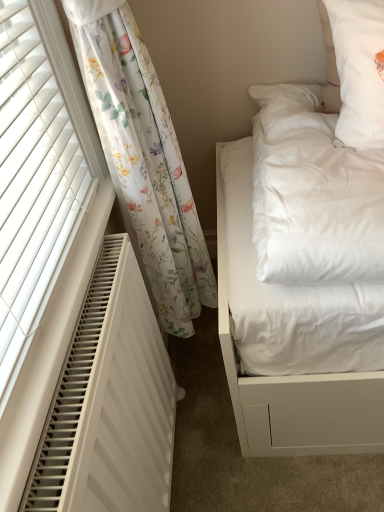
Question: From a real-world perspective, is floral sheer curtain at left positioned above or below white textured radiator at left?

Choices:
 (A) below
 (B) above

Answer: (B)

Question: Considering the positions of floral sheer curtain at left and white textured radiator at left in the image, is floral sheer curtain at left taller or shorter than white textured radiator at left?

Choices:
 (A) short
 (B) tall

Answer: (B)

Question: Relative to white textured radiator at left, is floral sheer curtain at left in front or behind?

Choices:
 (A) front
 (B) behind

Answer: (B)

Question: In terms of size, does white textured radiator at left appear bigger or smaller than floral sheer curtain at left?

Choices:
 (A) big
 (B) small

Answer: (B)

Question: From a real-world perspective, is white textured radiator at left above or below floral sheer curtain at left?

Choices:
 (A) below
 (B) above

Answer: (A)

Question: Is white textured radiator at left to the left or to the right of floral sheer curtain at left in the image?

Choices:
 (A) right
 (B) left

Answer: (B)

Question: From the image's perspective, is white textured radiator at left positioned above or below floral sheer curtain at left?

Choices:
 (A) below
 (B) above

Answer: (A)